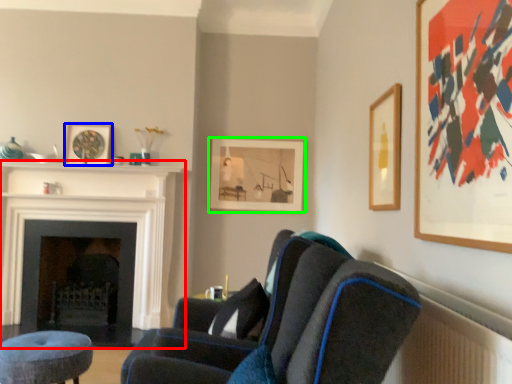
Question: Based on their relative distances, which object is nearer to fireplace (highlighted by a red box)? Choose from picture frame (highlighted by a blue box) and picture frame (highlighted by a green box).

Choices:
 (A) picture frame
 (B) picture frame

Answer: (A)